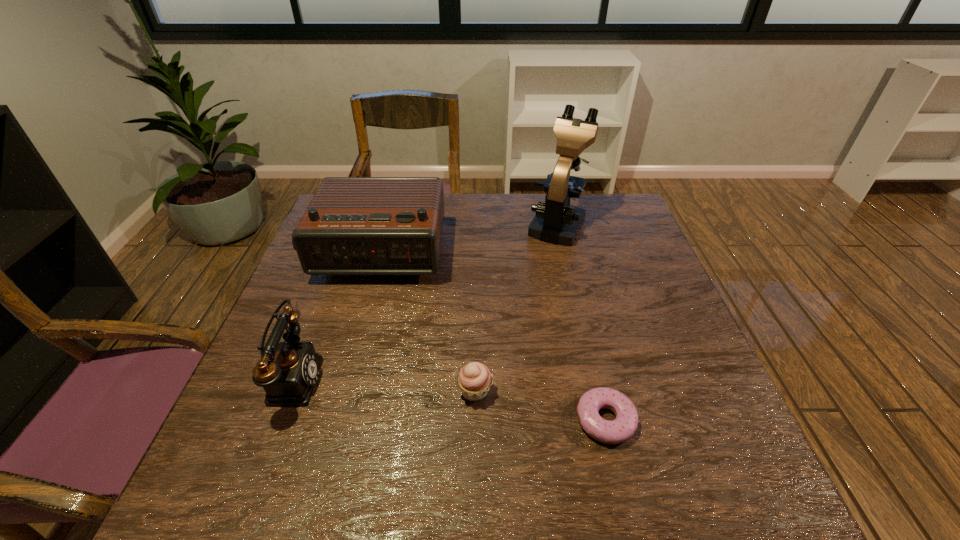
Locate an element on the screen. free space between the microscope and the radio receiver is located at coordinates (468, 238).

The height and width of the screenshot is (540, 960). Find the location of `vacant space that's between the radio receiver and the tallest object`. vacant space that's between the radio receiver and the tallest object is located at coordinates (468, 238).

Select which object appears as the fourth closest to the cupcake. Please provide its 2D coordinates. Your answer should be formatted as a tuple, i.e. [(x, y)], where the tuple contains the x and y coordinates of a point satisfying the conditions above.

[(557, 222)]

Where is `object that is the second closest to the microscope`? Image resolution: width=960 pixels, height=540 pixels. object that is the second closest to the microscope is located at coordinates (474, 380).

Find the location of a particular element. The image size is (960, 540). vacant area in the image that satisfies the following two spatial constraints: 1. on the back side of the microscope; 2. on the right side of the fourth tallest object is located at coordinates (476, 223).

At what (x,y) coordinates should I click in order to perform the action: click on free point that satisfies the following two spatial constraints: 1. on the front of the telephone at the rotary dial; 2. on the left side of the shortest object. Please return your answer as a coordinate pair (x, y). The image size is (960, 540). Looking at the image, I should click on (276, 420).

Locate an element on the screen. This screenshot has height=540, width=960. vacant area that satisfies the following two spatial constraints: 1. on the back side of the third object from right to left; 2. on the front of the third tallest object at the rotary dial is located at coordinates (474, 379).

Image resolution: width=960 pixels, height=540 pixels. In order to click on blank area in the image that satisfies the following two spatial constraints: 1. on the tuning display of the doughnut; 2. on the left side of the fourth shortest object in this screenshot , I will do `click(330, 420)`.

Identify the location of vacant region that satisfies the following two spatial constraints: 1. on the front of the third shortest object at the rotary dial; 2. on the back side of the doughnut. (276, 420).

This screenshot has width=960, height=540. In order to click on free location that satisfies the following two spatial constraints: 1. on the tuning display of the second tallest object; 2. on the front of the third tallest object at the rotary dial in this screenshot , I will do `click(342, 379)`.